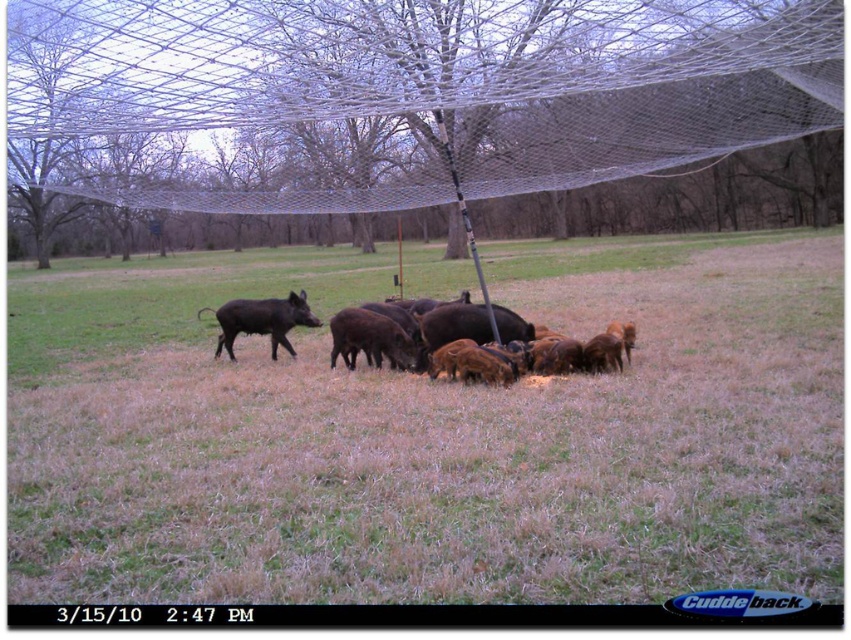
Does shiny black boar at center have a lesser height compared to dark brown fur at center?

Indeed, shiny black boar at center has a lesser height compared to dark brown fur at center.

Does shiny black boar at center appear on the left side of dark brown fur at center?

In fact, shiny black boar at center is to the right of dark brown fur at center.

Where is `shiny black boar at center`? The height and width of the screenshot is (640, 851). shiny black boar at center is located at coordinates (263, 321).

Where is `shiny black boar at center`? This screenshot has width=851, height=640. shiny black boar at center is located at coordinates (263, 321).

Is brown dry grass at center above dark brown fur piglet at center?

Indeed, brown dry grass at center is positioned over dark brown fur piglet at center.

Who is more forward, (804, 275) or (244, 308)?

Point (244, 308) is in front.

The image size is (851, 640). I want to click on brown dry grass at center, so click(430, 435).

The width and height of the screenshot is (851, 640). I want to click on brown dry grass at center, so click(x=430, y=435).

In the scene shown: Does brown dry grass at center have a greater width compared to white mesh net at center?

Correct, the width of brown dry grass at center exceeds that of white mesh net at center.

Can you confirm if brown dry grass at center is positioned to the right of white mesh net at center?

Indeed, brown dry grass at center is positioned on the right side of white mesh net at center.

Which is in front, point (374, 544) or point (269, 51)?

Point (374, 544) is more forward.

You are a GUI agent. You are given a task and a screenshot of the screen. Output one action in this format:
    pyautogui.click(x=<x>, y=<y>)
    Task: Click on the brown dry grass at center
    This screenshot has height=640, width=851.
    Given the screenshot: What is the action you would take?
    (x=430, y=435)